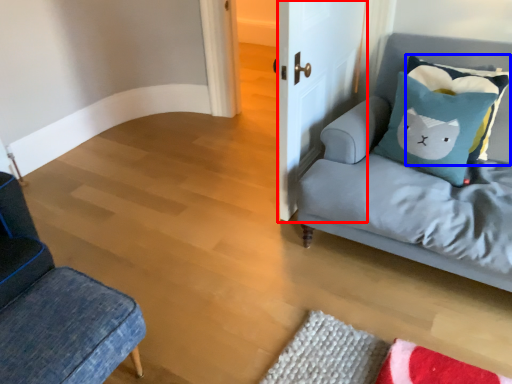
Question: Which object is closer to the camera taking this photo, door (highlighted by a red box) or pillow (highlighted by a blue box)?

Choices:
 (A) door
 (B) pillow

Answer: (A)